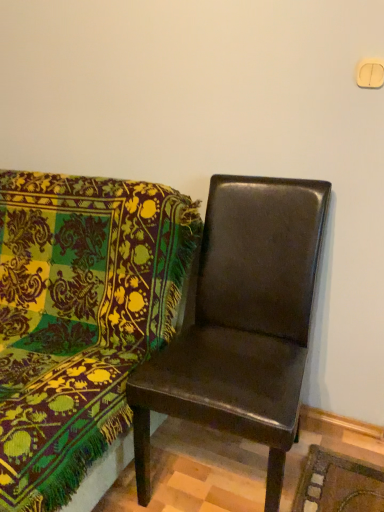
The image size is (384, 512). What do you see at coordinates (241, 324) in the screenshot? I see `leather-like brown chair at center, which ranks as the first chair in right-to-left order` at bounding box center [241, 324].

Where is `leather-like brown chair at center, which ranks as the first chair in right-to-left order`? This screenshot has height=512, width=384. leather-like brown chair at center, which ranks as the first chair in right-to-left order is located at coordinates (241, 324).

Where is `leather-like dark brown chair at right, which is the first chair from left to right`? The image size is (384, 512). leather-like dark brown chair at right, which is the first chair from left to right is located at coordinates (79, 318).

Describe the element at coordinates (79, 318) in the screenshot. I see `leather-like dark brown chair at right, the second chair positioned from the right` at that location.

Find the location of `leather-like brown chair at center, which ranks as the first chair in right-to-left order`. leather-like brown chair at center, which ranks as the first chair in right-to-left order is located at coordinates (241, 324).

Which object is positioned more to the right, leather-like brown chair at center, which ranks as the first chair in right-to-left order, or leather-like dark brown chair at right, which is the first chair from left to right?

leather-like brown chair at center, which ranks as the first chair in right-to-left order.

Which object is closer to the camera, leather-like brown chair at center, marked as the 2th chair in a left-to-right arrangement, or leather-like dark brown chair at right, the second chair positioned from the right?

leather-like dark brown chair at right, the second chair positioned from the right, is in front.

Is point (312, 193) in front of point (23, 228)?

Yes.

From the image's perspective, does leather-like brown chair at center, marked as the 2th chair in a left-to-right arrangement, appear lower than leather-like dark brown chair at right, which is the first chair from left to right?

Indeed, from the image's perspective, leather-like brown chair at center, marked as the 2th chair in a left-to-right arrangement, is shown beneath leather-like dark brown chair at right, which is the first chair from left to right.

From a real-world perspective, is leather-like brown chair at center, which ranks as the first chair in right-to-left order, beneath leather-like dark brown chair at right, the second chair positioned from the right?

No, from a real-world perspective, leather-like brown chair at center, which ranks as the first chair in right-to-left order, is not beneath leather-like dark brown chair at right, the second chair positioned from the right.

Based on the photo, can you confirm if leather-like brown chair at center, marked as the 2th chair in a left-to-right arrangement, is wider than leather-like dark brown chair at right, the second chair positioned from the right?

Incorrect, the width of leather-like brown chair at center, marked as the 2th chair in a left-to-right arrangement, does not surpass that of leather-like dark brown chair at right, the second chair positioned from the right.

Which of these two, leather-like brown chair at center, marked as the 2th chair in a left-to-right arrangement, or leather-like dark brown chair at right, which is the first chair from left to right, stands taller?

leather-like brown chair at center, marked as the 2th chair in a left-to-right arrangement, is taller.

Does leather-like brown chair at center, marked as the 2th chair in a left-to-right arrangement, have a smaller size compared to leather-like dark brown chair at right, which is the first chair from left to right?

Yes.

Looking at this image, is leather-like brown chair at center, marked as the 2th chair in a left-to-right arrangement, not inside leather-like dark brown chair at right, the second chair positioned from the right?

That's correct, leather-like brown chair at center, marked as the 2th chair in a left-to-right arrangement, is outside of leather-like dark brown chair at right, the second chair positioned from the right.

Are leather-like brown chair at center, which ranks as the first chair in right-to-left order, and leather-like dark brown chair at right, which is the first chair from left to right, located far from each other?

Result: No, there isn't a large distance between leather-like brown chair at center, which ranks as the first chair in right-to-left order, and leather-like dark brown chair at right, which is the first chair from left to right.

Is leather-like brown chair at center, marked as the 2th chair in a left-to-right arrangement, facing towards leather-like dark brown chair at right, the second chair positioned from the right?

No, leather-like brown chair at center, marked as the 2th chair in a left-to-right arrangement, is not turned towards leather-like dark brown chair at right, the second chair positioned from the right.

This screenshot has width=384, height=512. I want to click on chair located below the leather-like dark brown chair at right, which is the first chair from left to right (from the image's perspective), so click(241, 324).

Visually, is leather-like dark brown chair at right, which is the first chair from left to right, positioned to the left or to the right of leather-like brown chair at center, which ranks as the first chair in right-to-left order?

leather-like dark brown chair at right, which is the first chair from left to right, is positioned on leather-like brown chair at center, which ranks as the first chair in right-to-left order,'s left side.

Is leather-like dark brown chair at right, the second chair positioned from the right, in front of or behind leather-like brown chair at center, which ranks as the first chair in right-to-left order, in the image?

leather-like dark brown chair at right, the second chair positioned from the right, is positioned closer to the viewer than leather-like brown chair at center, which ranks as the first chair in right-to-left order.

Does point (129, 270) come in front of point (236, 385)?

No.

From the image's perspective, is leather-like dark brown chair at right, which is the first chair from left to right, positioned above or below leather-like brown chair at center, which ranks as the first chair in right-to-left order?

Clearly, from the image's perspective, leather-like dark brown chair at right, which is the first chair from left to right, is above leather-like brown chair at center, which ranks as the first chair in right-to-left order.

From a real-world perspective, is leather-like dark brown chair at right, the second chair positioned from the right, located beneath leather-like brown chair at center, which ranks as the first chair in right-to-left order?

Yes, from a real-world perspective, leather-like dark brown chair at right, the second chair positioned from the right, is beneath leather-like brown chair at center, which ranks as the first chair in right-to-left order.

Considering the sizes of objects leather-like dark brown chair at right, the second chair positioned from the right, and leather-like brown chair at center, which ranks as the first chair in right-to-left order, in the image provided, who is wider, leather-like dark brown chair at right, the second chair positioned from the right, or leather-like brown chair at center, which ranks as the first chair in right-to-left order,?

leather-like dark brown chair at right, the second chair positioned from the right, is wider.

Who is shorter, leather-like dark brown chair at right, which is the first chair from left to right, or leather-like brown chair at center, marked as the 2th chair in a left-to-right arrangement?

With less height is leather-like dark brown chair at right, which is the first chair from left to right.

In terms of size, does leather-like dark brown chair at right, which is the first chair from left to right, appear bigger or smaller than leather-like brown chair at center, which ranks as the first chair in right-to-left order?

In the image, leather-like dark brown chair at right, which is the first chair from left to right, appears to be larger than leather-like brown chair at center, which ranks as the first chair in right-to-left order.

Consider the image. Is leather-like dark brown chair at right, which is the first chair from left to right, outside of leather-like brown chair at center, which ranks as the first chair in right-to-left order?

leather-like dark brown chair at right, which is the first chair from left to right, lies outside leather-like brown chair at center, which ranks as the first chair in right-to-left order,'s area.

Are leather-like dark brown chair at right, the second chair positioned from the right, and leather-like brown chair at center, marked as the 2th chair in a left-to-right arrangement, far apart?

Actually, leather-like dark brown chair at right, the second chair positioned from the right, and leather-like brown chair at center, marked as the 2th chair in a left-to-right arrangement, are a little close together.

Does leather-like dark brown chair at right, which is the first chair from left to right, turn towards leather-like brown chair at center, marked as the 2th chair in a left-to-right arrangement?

No.

At what (x,y) coordinates should I click in order to perform the action: click on chair located on the left of leather-like brown chair at center, which ranks as the first chair in right-to-left order. Please return your answer as a coordinate pair (x, y). Looking at the image, I should click on (79, 318).

Where is `chair in front of the leather-like brown chair at center, which ranks as the first chair in right-to-left order`? This screenshot has width=384, height=512. chair in front of the leather-like brown chair at center, which ranks as the first chair in right-to-left order is located at coordinates (79, 318).

This screenshot has height=512, width=384. Identify the location of chair lying above the leather-like brown chair at center, marked as the 2th chair in a left-to-right arrangement (from the image's perspective). (79, 318).